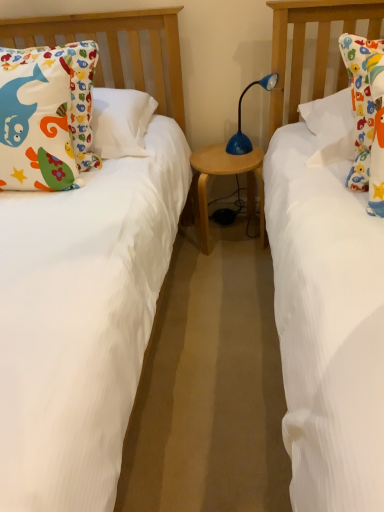
Question: Is the depth of matte cotton pillow at left greater than that of blue plastic table lamp at center?

Choices:
 (A) yes
 (B) no

Answer: (B)

Question: Is matte cotton pillow at left taller than blue plastic table lamp at center?

Choices:
 (A) yes
 (B) no

Answer: (A)

Question: Is matte cotton pillow at left outside blue plastic table lamp at center?

Choices:
 (A) no
 (B) yes

Answer: (B)

Question: Could you tell me if matte cotton pillow at left is turned towards blue plastic table lamp at center?

Choices:
 (A) yes
 (B) no

Answer: (B)

Question: Is matte cotton pillow at left thinner than blue plastic table lamp at center?

Choices:
 (A) yes
 (B) no

Answer: (B)

Question: Would you say matte cotton pillow at left is to the left or to the right of wooden table at center in the picture?

Choices:
 (A) left
 (B) right

Answer: (A)

Question: Considering their positions, is matte cotton pillow at left located in front of or behind wooden table at center?

Choices:
 (A) front
 (B) behind

Answer: (A)

Question: Is matte cotton pillow at left wider or thinner than wooden table at center?

Choices:
 (A) wide
 (B) thin

Answer: (B)

Question: Do you think matte cotton pillow at left is within wooden table at center, or outside of it?

Choices:
 (A) inside
 (B) outside

Answer: (B)

Question: Is blue plastic table lamp at center spatially inside matte cotton pillow at left, or outside of it?

Choices:
 (A) inside
 (B) outside

Answer: (B)

Question: Considering the positions of blue plastic table lamp at center and matte cotton pillow at left in the image, is blue plastic table lamp at center bigger or smaller than matte cotton pillow at left?

Choices:
 (A) big
 (B) small

Answer: (B)

Question: Based on their positions, is blue plastic table lamp at center located to the left or right of matte cotton pillow at left?

Choices:
 (A) right
 (B) left

Answer: (A)

Question: From a real-world perspective, is blue plastic table lamp at center above or below matte cotton pillow at left?

Choices:
 (A) above
 (B) below

Answer: (B)

Question: From the image's perspective, is wooden table at center located above or below blue plastic table lamp at center?

Choices:
 (A) below
 (B) above

Answer: (A)

Question: From a real-world perspective, is wooden table at center physically located above or below blue plastic table lamp at center?

Choices:
 (A) below
 (B) above

Answer: (A)